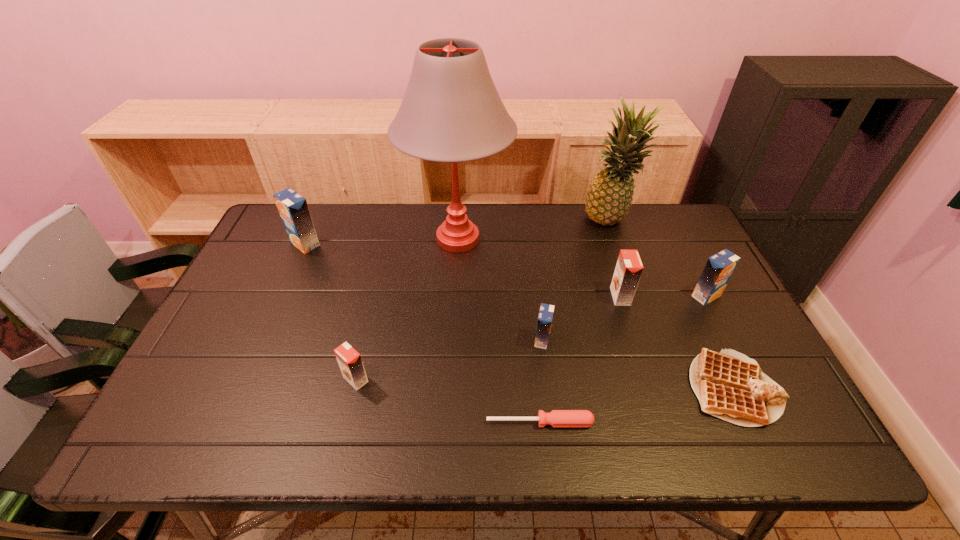
The width and height of the screenshot is (960, 540). In order to click on the smallest blue orange_juice in this screenshot , I will do tap(544, 322).

Where is `the nearest blue orange_juice`? Image resolution: width=960 pixels, height=540 pixels. the nearest blue orange_juice is located at coordinates coord(544,322).

Where is `the nearer orange orange juice`? the nearer orange orange juice is located at coordinates (349, 360).

The width and height of the screenshot is (960, 540). In order to click on the second object from left to right in this screenshot , I will do `click(349, 360)`.

This screenshot has height=540, width=960. Identify the location of the second shortest object. (729, 385).

Where is `the shortest object`? The height and width of the screenshot is (540, 960). the shortest object is located at coordinates (556, 418).

Find the location of a particular element. screwdriver is located at coordinates (556, 418).

This screenshot has width=960, height=540. I want to click on blank space located 0.160m on the front-facing side of the tallest object, so click(x=453, y=317).

This screenshot has width=960, height=540. In order to click on free space located 0.150m on the left of the pineapple in this screenshot , I will do `click(539, 221)`.

In order to click on vacant position located 0.070m on the left of the leftmost orange juice in this screenshot , I will do pos(267,244).